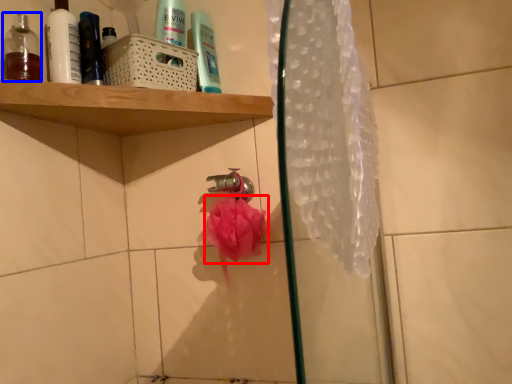
Question: Among these objects, which one is nearest to the camera, flower (highlighted by a red box) or mouthwash (highlighted by a blue box)?

Choices:
 (A) flower
 (B) mouthwash

Answer: (B)